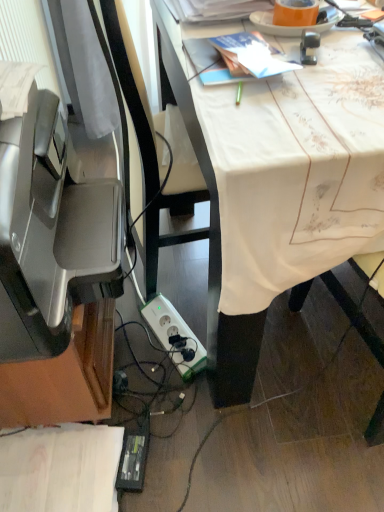
Question: From the image's perspective, would you say white plastic power plugs and sockets at lower center is positioned over white cloth-covered desk at center?

Choices:
 (A) no
 (B) yes

Answer: (A)

Question: Considering the relative positions of white plastic power plugs and sockets at lower center and white cloth-covered desk at center in the image provided, is white plastic power plugs and sockets at lower center behind white cloth-covered desk at center?

Choices:
 (A) no
 (B) yes

Answer: (B)

Question: Is white plastic power plugs and sockets at lower center thinner than white cloth-covered desk at center?

Choices:
 (A) no
 (B) yes

Answer: (B)

Question: Is white plastic power plugs and sockets at lower center at the left side of white cloth-covered desk at center?

Choices:
 (A) yes
 (B) no

Answer: (A)

Question: Considering the relative positions of white plastic power plugs and sockets at lower center and white cloth-covered desk at center in the image provided, is white plastic power plugs and sockets at lower center to the right of white cloth-covered desk at center from the viewer's perspective?

Choices:
 (A) no
 (B) yes

Answer: (A)

Question: Can you confirm if white plastic power plugs and sockets at lower center is smaller than white cloth-covered desk at center?

Choices:
 (A) yes
 (B) no

Answer: (A)

Question: From the image's perspective, is white cloth-covered desk at center above satin silver printer at left?

Choices:
 (A) no
 (B) yes

Answer: (B)

Question: Is white cloth-covered desk at center with satin silver printer at left?

Choices:
 (A) no
 (B) yes

Answer: (A)

Question: From the image's perspective, is white cloth-covered desk at center below satin silver printer at left?

Choices:
 (A) no
 (B) yes

Answer: (A)

Question: From a real-world perspective, is white cloth-covered desk at center below satin silver printer at left?

Choices:
 (A) no
 (B) yes

Answer: (B)

Question: Is the depth of white cloth-covered desk at center less than that of satin silver printer at left?

Choices:
 (A) no
 (B) yes

Answer: (A)

Question: Is white cloth-covered desk at center to the left of satin silver printer at left from the viewer's perspective?

Choices:
 (A) yes
 (B) no

Answer: (B)

Question: From a real-world perspective, is white cloth-covered desk at center under white plastic power plugs and sockets at lower center?

Choices:
 (A) no
 (B) yes

Answer: (A)